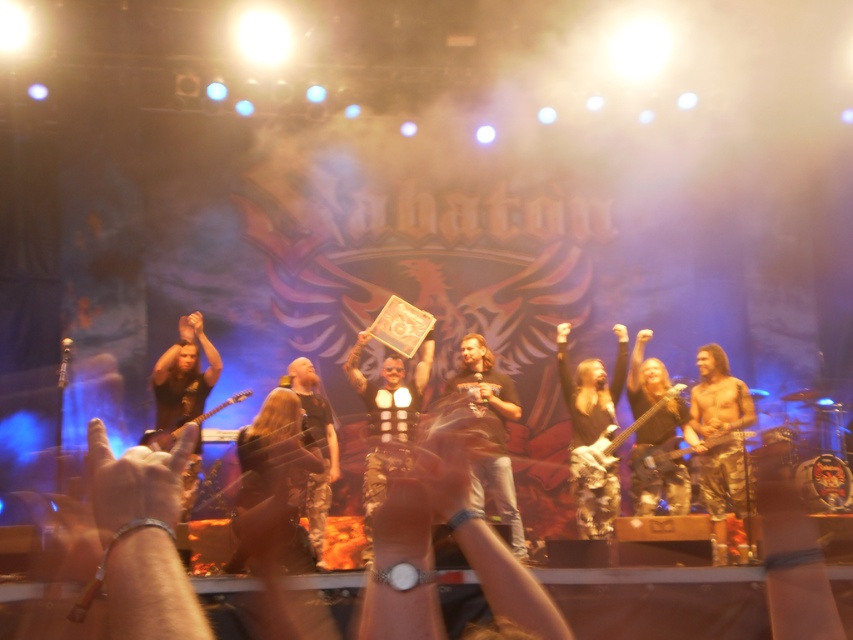
Question: Is brown leather jacket at center to the right of camouflage-patterned guitar at center from the viewer's perspective?

Choices:
 (A) yes
 (B) no

Answer: (B)

Question: Which of the following is the closest to the observer?

Choices:
 (A) camouflage-patterned guitar at center
 (B) metallic bass guitar at center
 (C) brown leather jacket at center

Answer: (C)

Question: Does brown leather jacket at center appear on the right side of metallic bass guitar at center?

Choices:
 (A) no
 (B) yes

Answer: (A)

Question: Which point is closer to the camera taking this photo?

Choices:
 (A) (460, 342)
 (B) (612, 429)
 (C) (651, 465)

Answer: (C)

Question: Among these points, which one is farthest from the camera?

Choices:
 (A) (782, 435)
 (B) (490, 355)
 (C) (639, 422)

Answer: (A)

Question: In this image, where is brown leather jacket at center located relative to camouflage-patterned guitar at center?

Choices:
 (A) below
 (B) above

Answer: (A)